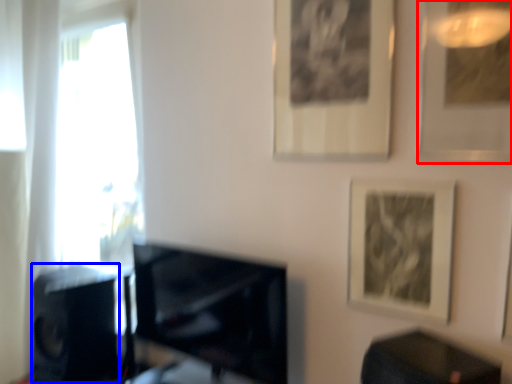
Question: Which of the following is the farthest to the observer, picture frame (highlighted by a red box) or speaker (highlighted by a blue box)?

Choices:
 (A) picture frame
 (B) speaker

Answer: (B)